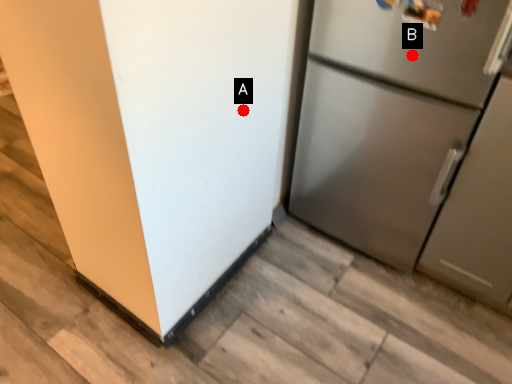
Question: Two points are circled on the image, labeled by A and B beside each circle. Which point is closer to the camera?

Choices:
 (A) A is closer
 (B) B is closer

Answer: (B)